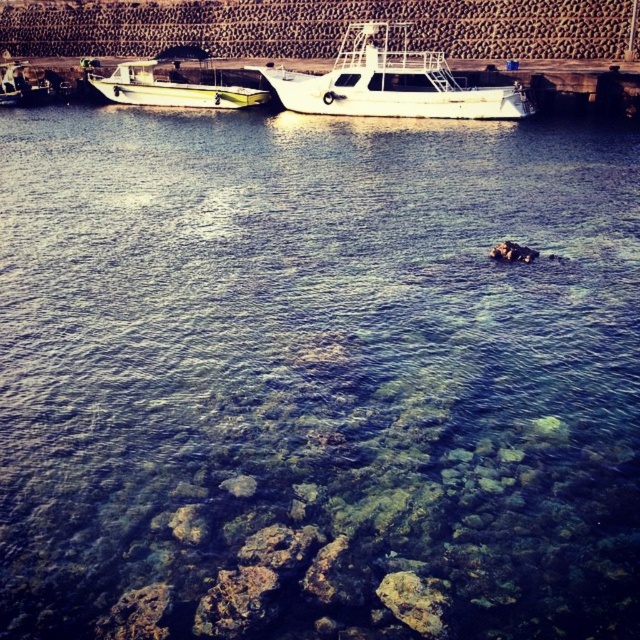
Can you confirm if white glossy boat at center is bigger than metallic silver boat at left?

Correct, white glossy boat at center is larger in size than metallic silver boat at left.

Is point (417, 100) positioned before point (4, 102)?

Yes, it is.

Is point (356, 48) positioned in front of point (10, 68)?

Yes, it is.

Where is `white glossy boat at center`? The width and height of the screenshot is (640, 640). white glossy boat at center is located at coordinates (390, 81).

Between point (120, 92) and point (172, 74), which one is positioned behind?

Positioned behind is point (172, 74).

Who is more forward, (x=173, y=106) or (x=179, y=77)?

Positioned in front is point (x=173, y=106).

At what (x,y) coordinates should I click in order to perform the action: click on green matte boat at left. Please return your answer as a coordinate pair (x, y). The width and height of the screenshot is (640, 640). Looking at the image, I should click on (170, 90).

Based on the photo, is white glossy boat at center positioned in front of green matte boat at left?

That is True.

Is white glossy boat at center to the right of green matte boat at left from the viewer's perspective?

Indeed, white glossy boat at center is positioned on the right side of green matte boat at left.

Between point (280, 88) and point (122, 83), which one is positioned in front?

Point (280, 88) is in front.

Where is `white glossy boat at center`? The width and height of the screenshot is (640, 640). white glossy boat at center is located at coordinates (390, 81).